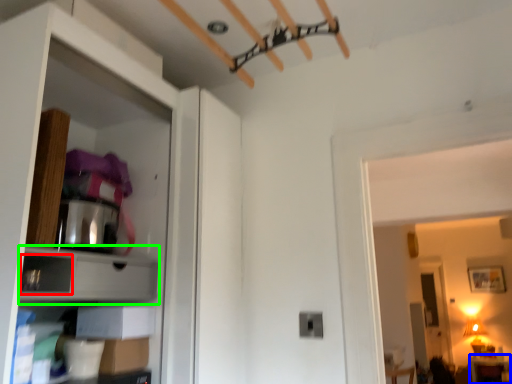
Question: Considering the real-world distances, which object is closest to drawer (highlighted by a red box)? furniture (highlighted by a blue box) or cabinet (highlighted by a green box).

Choices:
 (A) furniture
 (B) cabinet

Answer: (B)